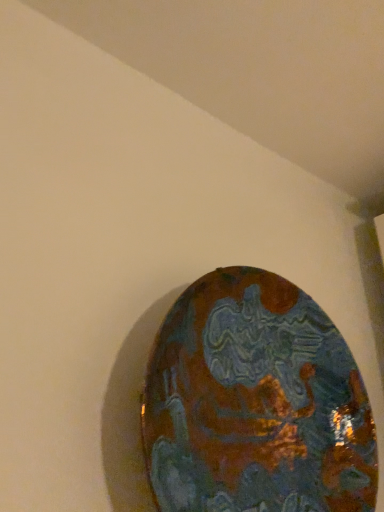
Describe the element at coordinates (255, 403) in the screenshot. I see `shiny metallic plate at center` at that location.

The image size is (384, 512). I want to click on shiny metallic plate at center, so click(x=255, y=403).

The image size is (384, 512). Find the location of `shiny metallic plate at center`. shiny metallic plate at center is located at coordinates (255, 403).